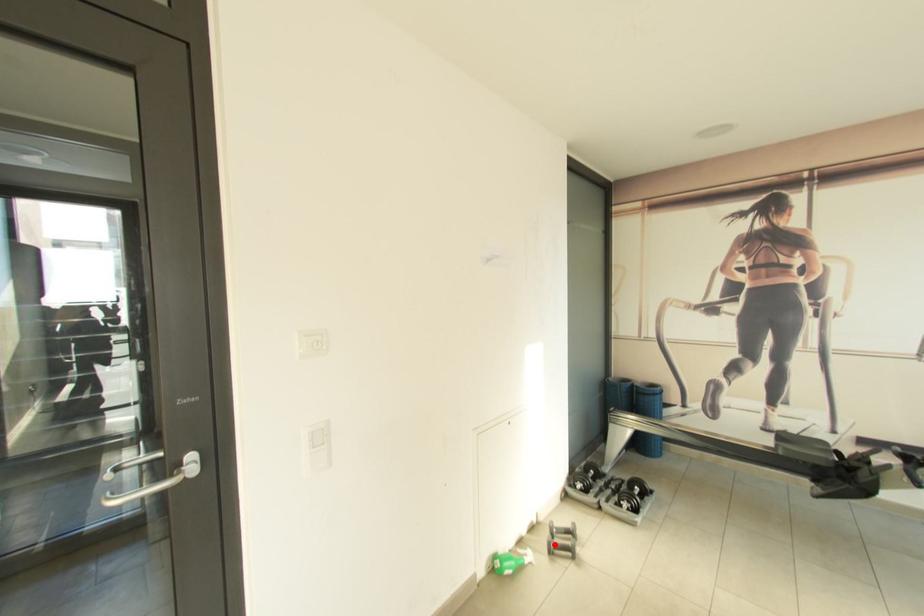
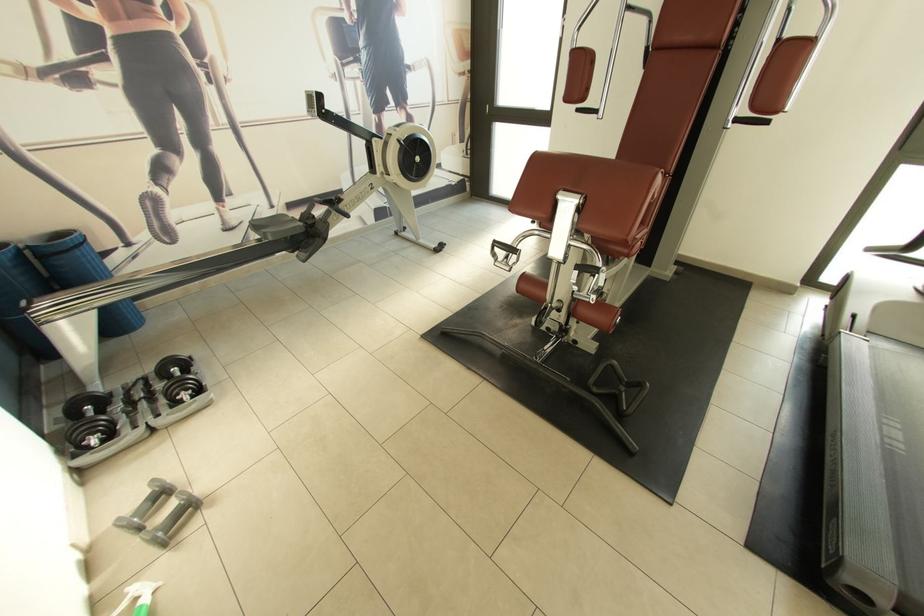
Question: I am providing you with two images of the same scene from different viewpoints. A red point is marked on the first image. At the location where the point appears in image 1, is it still visible in image 2?

Choices:
 (A) Yes
 (B) No

Answer: (A)